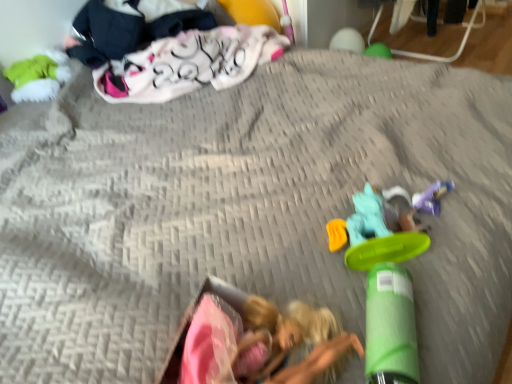
Question: Is translucent plastic toy at center, which ranks as the third toy in back-to-front order, far from purple plastic toy at lower right, marked as the third toy in a bottom-to-top arrangement?

Choices:
 (A) no
 (B) yes

Answer: (A)

Question: Is translucent plastic toy at center, which is counted as the third toy, starting from the left, smaller than purple plastic toy at lower right, which is the 4th toy from left to right?

Choices:
 (A) no
 (B) yes

Answer: (A)

Question: Could you tell me if translucent plastic toy at center, which is counted as the third toy, starting from the left, is turned towards purple plastic toy at lower right, the second toy positioned from the back?

Choices:
 (A) no
 (B) yes

Answer: (A)

Question: Is translucent plastic toy at center, which is counted as the third toy, starting from the left, not within purple plastic toy at lower right, which is counted as the first toy, starting from the right?

Choices:
 (A) no
 (B) yes

Answer: (B)

Question: Is translucent plastic toy at center, which is counted as the third toy, starting from the left, at the right side of purple plastic toy at lower right, which appears as the 3th toy when viewed from the front?

Choices:
 (A) no
 (B) yes

Answer: (A)

Question: Is translucent plastic toy at center, placed as the second toy when sorted from right to left, shorter than purple plastic toy at lower right, marked as the third toy in a bottom-to-top arrangement?

Choices:
 (A) no
 (B) yes

Answer: (A)

Question: Considering the relative sizes of matte green plush at upper left, arranged as the fourth toy when ordered from the bottom, and fluffy pink blanket at upper left, the second clothing viewed from the left, in the image provided, is matte green plush at upper left, arranged as the fourth toy when ordered from the bottom, wider than fluffy pink blanket at upper left, the second clothing viewed from the left,?

Choices:
 (A) yes
 (B) no

Answer: (B)

Question: Are matte green plush at upper left, the 1th toy from the back, and fluffy pink blanket at upper left, marked as the first clothing in a right-to-left arrangement, far apart?

Choices:
 (A) yes
 (B) no

Answer: (B)

Question: Is matte green plush at upper left, positioned as the 4th toy in front-to-back order, looking in the opposite direction of fluffy pink blanket at upper left, marked as the first clothing in a right-to-left arrangement?

Choices:
 (A) no
 (B) yes

Answer: (A)

Question: Is fluffy pink blanket at upper left, marked as the first clothing in a right-to-left arrangement, inside matte green plush at upper left, the 1th toy from the top?

Choices:
 (A) yes
 (B) no

Answer: (B)

Question: Is matte green plush at upper left, the 1th toy from the top, closer to the viewer compared to fluffy pink blanket at upper left, the second clothing viewed from the left?

Choices:
 (A) no
 (B) yes

Answer: (A)

Question: Considering the relative sizes of matte green plush at upper left, which is the first toy from left to right, and fluffy pink blanket at upper left, marked as the first clothing in a right-to-left arrangement, in the image provided, is matte green plush at upper left, which is the first toy from left to right, smaller than fluffy pink blanket at upper left, marked as the first clothing in a right-to-left arrangement,?

Choices:
 (A) no
 (B) yes

Answer: (B)

Question: Does green matte cylinder at lower right, which ranks as the second toy in left-to-right order, turn towards purple plastic toy at lower right, which is the 4th toy from left to right?

Choices:
 (A) yes
 (B) no

Answer: (A)